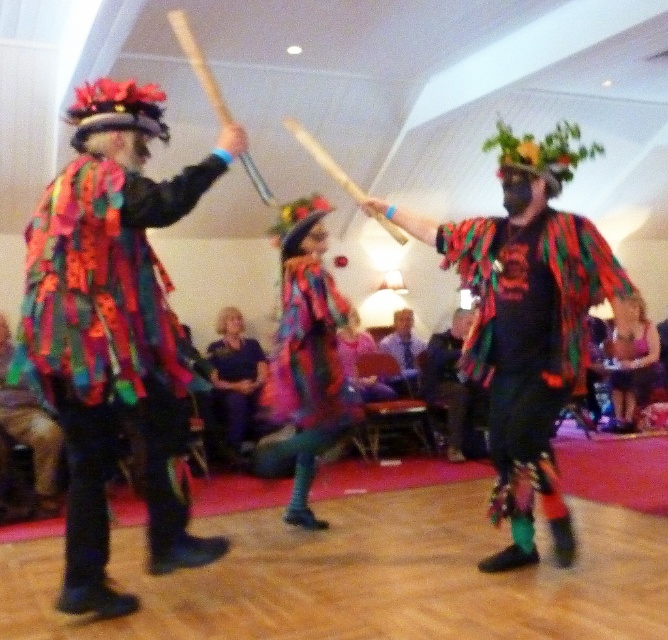
Can you confirm if multicolored fabric scarf at center is wider than multicolored fabric dress at lower right?

Yes.

Locate an element on the screen. Image resolution: width=668 pixels, height=640 pixels. multicolored fabric scarf at center is located at coordinates (574, 289).

Where is `multicolored fabric scarf at center`? This screenshot has height=640, width=668. multicolored fabric scarf at center is located at coordinates (574, 289).

Is point (309, 355) farther from viewer compared to point (562, 259)?

Yes, it is behind point (562, 259).

Who is more forward, (345, 394) or (492, 368)?

Point (492, 368)

Does point (293, 291) come closer to viewer compared to point (468, 230)?

No, it is not.

Locate an element on the screen. Image resolution: width=668 pixels, height=640 pixels. multicolored fabric costume at center is located at coordinates (307, 352).

Is point (480, 236) positioned before point (224, 378)?

Yes, point (480, 236) is closer to viewer.

Between multicolored fabric scarf at center and purple fabric dress at center, which one appears on the left side from the viewer's perspective?

Positioned to the left is purple fabric dress at center.

What do you see at coordinates (574, 289) in the screenshot?
I see `multicolored fabric scarf at center` at bounding box center [574, 289].

Image resolution: width=668 pixels, height=640 pixels. In order to click on multicolored fabric scarf at center in this screenshot , I will do tap(574, 289).